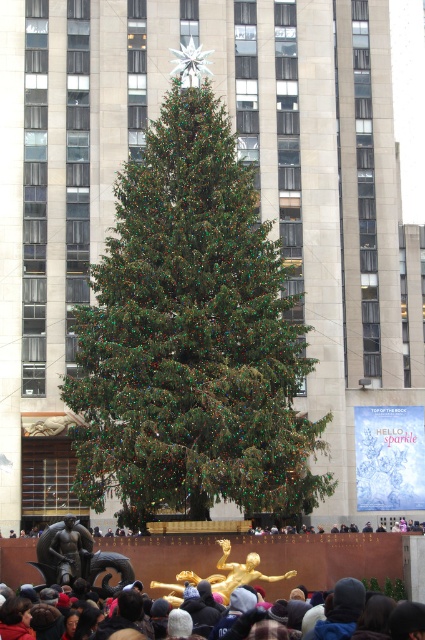
Question: Can you confirm if green matte christmas tree at center is positioned to the left of dark gray knit hats at lower center?

Choices:
 (A) no
 (B) yes

Answer: (B)

Question: Which point is closer to the camera taking this photo?

Choices:
 (A) (229, 182)
 (B) (368, 608)

Answer: (B)

Question: Which of the following is the farthest from the observer?

Choices:
 (A) (237, 218)
 (B) (408, 637)

Answer: (A)

Question: Which point appears closest to the camera in this image?

Choices:
 (A) (150, 392)
 (B) (393, 637)

Answer: (B)

Question: Does green matte christmas tree at center appear on the left side of dark gray knit hats at lower center?

Choices:
 (A) yes
 (B) no

Answer: (A)

Question: Does green matte christmas tree at center appear over dark gray knit hats at lower center?

Choices:
 (A) yes
 (B) no

Answer: (A)